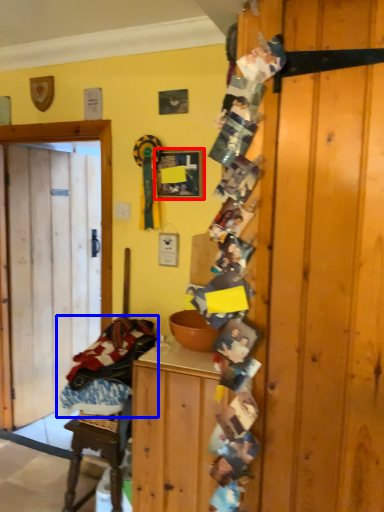
Question: Which object is further to the camera taking this photo, picture frame (highlighted by a red box) or laundry (highlighted by a blue box)?

Choices:
 (A) picture frame
 (B) laundry

Answer: (A)